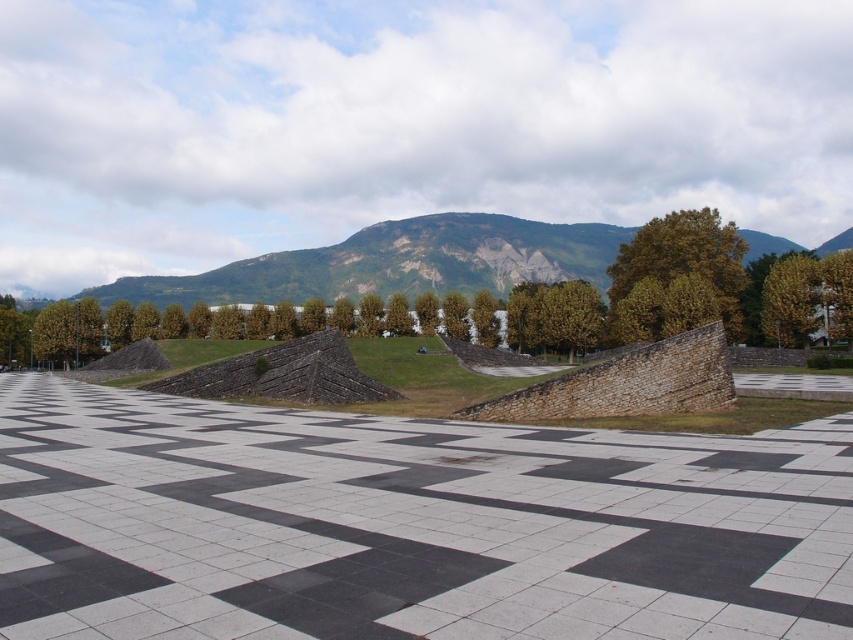
Does green leafy tree at upper right have a lesser width compared to green leafy tree at right?

In fact, green leafy tree at upper right might be wider than green leafy tree at right.

Is green leafy tree at upper right positioned at the back of green leafy tree at right?

Yes, it is.

Is point (618, 252) less distant than point (782, 262)?

That is False.

The image size is (853, 640). I want to click on green leafy tree at upper right, so click(x=683, y=257).

Looking at this image, does black and white stone plaza at center appear on the left side of green leafy tree at upper right?

Indeed, black and white stone plaza at center is positioned on the left side of green leafy tree at upper right.

Is point (311, 557) in front of point (639, 244)?

Yes, point (311, 557) is in front of point (639, 244).

Between point (160, 609) and point (674, 260), which one is positioned behind?

The point (674, 260) is behind.

This screenshot has height=640, width=853. Find the location of `black and white stone plaza at center`. black and white stone plaza at center is located at coordinates (407, 524).

Can you confirm if black and white stone plaza at center is shorter than green leafy tree at right?

Indeed, black and white stone plaza at center has a lesser height compared to green leafy tree at right.

Between black and white stone plaza at center and green leafy tree at right, which one is positioned higher?

green leafy tree at right

Is point (351, 458) in front of point (804, 285)?

Yes, point (351, 458) is closer to viewer.

What are the coordinates of `black and white stone plaza at center` in the screenshot? It's located at click(407, 524).